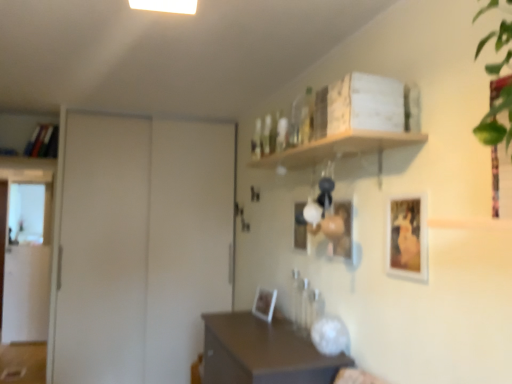
Describe the element at coordinates (103, 250) in the screenshot. Image resolution: width=512 pixels, height=384 pixels. I see `white matte door at left` at that location.

The width and height of the screenshot is (512, 384). What do you see at coordinates (339, 229) in the screenshot?
I see `matte wooden picture frame at center, which appears as the second picture frame when viewed from the right` at bounding box center [339, 229].

Image resolution: width=512 pixels, height=384 pixels. Identify the location of wooden shelf at upper center. (338, 148).

Locate an element on the screen. Image resolution: width=512 pixels, height=384 pixels. translucent glass bottle at upper center is located at coordinates (306, 117).

You are a GUI agent. You are given a task and a screenshot of the screen. Output one action in this format:
    pyautogui.click(x=<x>, y=<y>)
    Task: Click on the gold-framed artwork at right, the 4th picture frame positioned from the back
    
    Given the screenshot: What is the action you would take?
    pyautogui.click(x=407, y=237)

Describe the element at coordinates (263, 352) in the screenshot. This screenshot has width=512, height=384. I see `brown matte table at center` at that location.

Where is `white matte door at left`? The height and width of the screenshot is (384, 512). white matte door at left is located at coordinates (103, 250).

Does matte wooden picture frame at center, which is counted as the 3th picture frame, starting from the back, contain wooden shelf at upper center?

No, wooden shelf at upper center is located outside of matte wooden picture frame at center, which is counted as the 3th picture frame, starting from the back.

Considering their positions, is matte wooden picture frame at center, which is counted as the 3th picture frame, starting from the back, located in front of or behind wooden shelf at upper center?

Clearly, matte wooden picture frame at center, which is counted as the 3th picture frame, starting from the back, is behind wooden shelf at upper center.

Can you confirm if matte wooden picture frame at center, which is the 3th picture frame in left-to-right order, is taller than wooden shelf at upper center?

Yes.

Is matte white picture frame at center, the first picture frame when ordered from left to right, shorter than gold-framed artwork at right, positioned as the fourth picture frame in left-to-right order?

Yes.

Considering the relative positions of matte white picture frame at center, the 4th picture frame from the right, and gold-framed artwork at right, the first picture frame from the front, in the image provided, is matte white picture frame at center, the 4th picture frame from the right, to the left of gold-framed artwork at right, the first picture frame from the front, from the viewer's perspective?

Correct, you'll find matte white picture frame at center, the 4th picture frame from the right, to the left of gold-framed artwork at right, the first picture frame from the front.

Is matte white picture frame at center, the first picture frame when ordered from left to right, inside the boundaries of gold-framed artwork at right, positioned as the fourth picture frame in left-to-right order, or outside?

matte white picture frame at center, the first picture frame when ordered from left to right, exists outside the volume of gold-framed artwork at right, positioned as the fourth picture frame in left-to-right order.

Which object is closer to the camera taking this photo, matte white picture frame at center, the first picture frame when ordered from left to right, or gold-framed artwork at right, which is counted as the first picture frame, starting from the right?

gold-framed artwork at right, which is counted as the first picture frame, starting from the right, is closer to the camera.

From the image's perspective, would you say brown matte table at center is positioned over matte white picture frame at center, the 4th picture frame from the right?

Actually, brown matte table at center appears below matte white picture frame at center, the 4th picture frame from the right, in the image.

In terms of height, does brown matte table at center look taller or shorter compared to matte white picture frame at center, the 1th picture frame from the back?

Clearly, brown matte table at center is taller compared to matte white picture frame at center, the 1th picture frame from the back.

At what (x,y) coordinates should I click in order to perform the action: click on picture frame that is the 3rd one when counting backward from the brown matte table at center. Please return your answer as a coordinate pair (x, y). Image resolution: width=512 pixels, height=384 pixels. Looking at the image, I should click on (264, 303).

Can you confirm if brown matte table at center is smaller than matte white picture frame at center, the first picture frame when ordered from left to right?

No.

Find the location of a particular element. the 1st picture frame positioned below the gold-framed artwork at right, which is counted as the first picture frame, starting from the right (from the image's perspective) is located at coordinates (339, 229).

Looking at this image, how many degrees apart are the facing directions of gold-framed artwork at right, the 4th picture frame positioned from the back, and matte wooden picture frame at center, which is counted as the 3th picture frame, starting from the back?

The angular difference between gold-framed artwork at right, the 4th picture frame positioned from the back, and matte wooden picture frame at center, which is counted as the 3th picture frame, starting from the back, is 0.00676 degrees.

Could you tell me if gold-framed artwork at right, the 4th picture frame positioned from the back, is turned towards matte wooden picture frame at center, which appears as the second picture frame when viewed from the right?

No, gold-framed artwork at right, the 4th picture frame positioned from the back, does not turn towards matte wooden picture frame at center, which appears as the second picture frame when viewed from the right.

In the scene shown: Which is closer, (407, 203) or (339, 211)?

The point (407, 203) is closer to the camera.

Is brown matte table at center at the back of matte wooden picture frame at center, which is counted as the 3th picture frame, starting from the back?

matte wooden picture frame at center, which is counted as the 3th picture frame, starting from the back, does not have its back to brown matte table at center.

Identify the location of table below the matte wooden picture frame at center, which is the 3th picture frame in left-to-right order (from the image's perspective). (263, 352).

Would you say matte wooden picture frame at center, which appears as the second picture frame when viewed from the right, is inside or outside brown matte table at center?

matte wooden picture frame at center, which appears as the second picture frame when viewed from the right, cannot be found inside brown matte table at center.

Can you confirm if wooden shelf at upper center is positioned to the left of matte wooden picture frame at center, the 2th picture frame in the front-to-back sequence?

Indeed, wooden shelf at upper center is positioned on the left side of matte wooden picture frame at center, the 2th picture frame in the front-to-back sequence.

How many degrees apart are the facing directions of wooden shelf at upper center and matte wooden picture frame at center, the 2th picture frame in the front-to-back sequence?

They differ by 1.23 degrees in their facing directions.

Which is behind, wooden shelf at upper center or matte wooden picture frame at center, the 2th picture frame in the front-to-back sequence?

matte wooden picture frame at center, the 2th picture frame in the front-to-back sequence, is more distant.

From the image's perspective, is wooden shelf at upper center beneath matte wooden picture frame at center, which appears as the second picture frame when viewed from the right?

Actually, wooden shelf at upper center appears above matte wooden picture frame at center, which appears as the second picture frame when viewed from the right, in the image.

This screenshot has width=512, height=384. I want to click on shelf above the gold-framed artwork at right, positioned as the fourth picture frame in left-to-right order (from the image's perspective), so click(338, 148).

Is the depth of wooden shelf at upper center less than that of gold-framed artwork at right, which is counted as the first picture frame, starting from the right?

Yes, wooden shelf at upper center is closer to the viewer.

Choose the correct answer: Is wooden shelf at upper center inside gold-framed artwork at right, the first picture frame from the front, or outside it?

wooden shelf at upper center exists outside the volume of gold-framed artwork at right, the first picture frame from the front.

Is wooden shelf at upper center thinner than gold-framed artwork at right, which is counted as the first picture frame, starting from the right?

Incorrect, the width of wooden shelf at upper center is not less than that of gold-framed artwork at right, which is counted as the first picture frame, starting from the right.

Where is `shelf above the matte wooden picture frame at center, which appears as the second picture frame when viewed from the right (from the image's perspective)`? shelf above the matte wooden picture frame at center, which appears as the second picture frame when viewed from the right (from the image's perspective) is located at coordinates (338, 148).

From the matte white picture frame at center, which ranks as the fourth picture frame in front-to-back order, count 3rd picture frames forward and point to it. Please provide its 2D coordinates.

[(407, 237)]

When comparing their distances from brown matte table at center, does matte wooden picture frame at center, which is the 3th picture frame in left-to-right order, or wooden shelf at upper center seem closer?

The object closer to brown matte table at center is matte wooden picture frame at center, which is the 3th picture frame in left-to-right order.

Based on their spatial positions, is white matte door at left or gold-framed artwork at right, the first picture frame from the front, further from matte wooden picture frame at center, which appears as the second picture frame when viewed from the right?

white matte door at left is further to matte wooden picture frame at center, which appears as the second picture frame when viewed from the right.

From the image, which object appears to be nearer to translucent glass bottle at upper center, matte wooden picture frame at center, which appears as the second picture frame when viewed from the right, or white matte door at left?

Based on the image, matte wooden picture frame at center, which appears as the second picture frame when viewed from the right, appears to be nearer to translucent glass bottle at upper center.

When comparing their distances from white matte door at left, does gold-framed artwork at right, the 4th picture frame positioned from the back, or brown matte table at center seem further?

gold-framed artwork at right, the 4th picture frame positioned from the back, is positioned further to the anchor white matte door at left.

Looking at the image, which one is located closer to matte wooden picture frame at center, the 2th picture frame in the front-to-back sequence, wooden shelf at upper center or brown matte table at center?

Based on the image, wooden shelf at upper center appears to be nearer to matte wooden picture frame at center, the 2th picture frame in the front-to-back sequence.

Based on their spatial positions, is matte white picture frame at center, which ranks as the fourth picture frame in front-to-back order, or gold-framed artwork at right, the first picture frame from the front, further from wooden shelf at upper center?

matte white picture frame at center, which ranks as the fourth picture frame in front-to-back order, lies further to wooden shelf at upper center than the other object.

Considering their positions, is matte white picture frame at center, which ranks as the fourth picture frame in front-to-back order, positioned closer to translucent glass bottle at upper center than matte black picture frame at center, arranged as the second picture frame when viewed from the back?

matte black picture frame at center, arranged as the second picture frame when viewed from the back, lies closer to translucent glass bottle at upper center than the other object.

Considering their positions, is brown matte table at center positioned closer to matte white picture frame at center, the 4th picture frame from the right, than translucent glass bottle at upper center?

Among the two, brown matte table at center is located nearer to matte white picture frame at center, the 4th picture frame from the right.

Where is `table between wooden shelf at upper center and matte white picture frame at center, which ranks as the fourth picture frame in front-to-back order, along the z-axis`? This screenshot has height=384, width=512. table between wooden shelf at upper center and matte white picture frame at center, which ranks as the fourth picture frame in front-to-back order, along the z-axis is located at coordinates (263, 352).

You are a GUI agent. You are given a task and a screenshot of the screen. Output one action in this format:
    pyautogui.click(x=<x>, y=<y>)
    Task: Click on the shelf that lies between translucent glass bottle at upper center and brown matte table at center from top to bottom
    
    Given the screenshot: What is the action you would take?
    pyautogui.click(x=338, y=148)

Locate an element on the screen. picture frame between white matte door at left and matte black picture frame at center, arranged as the second picture frame when viewed from the back is located at coordinates (264, 303).

Find the location of a particular element. Image resolution: width=512 pixels, height=384 pixels. bottle between gold-framed artwork at right, positioned as the fourth picture frame in left-to-right order, and matte black picture frame at center, acting as the 3th picture frame starting from the front, along the z-axis is located at coordinates (306, 117).